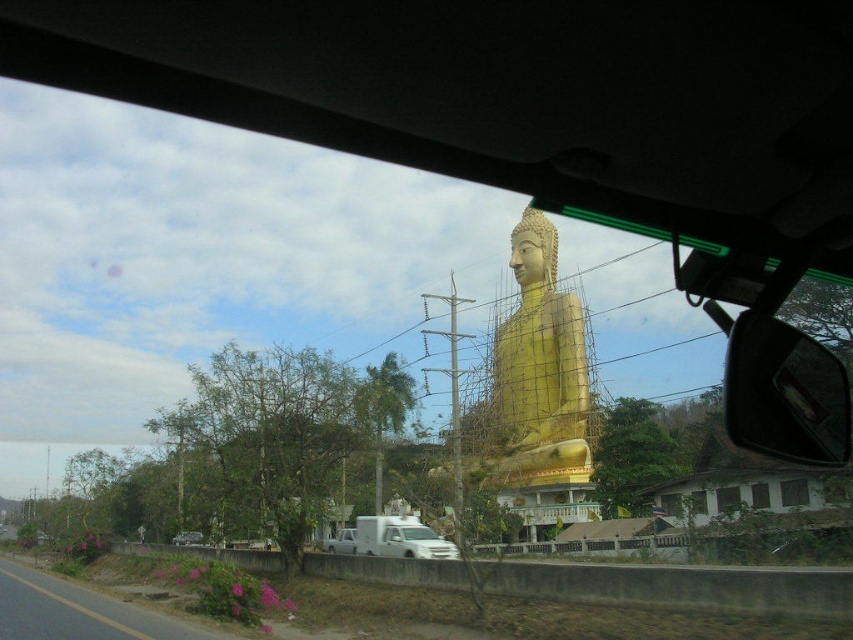
Does gold polished statue at center appear over metallic silver car at lower left?

Correct, gold polished statue at center is located above metallic silver car at lower left.

Locate an element on the screen. Image resolution: width=853 pixels, height=640 pixels. gold polished statue at center is located at coordinates (537, 372).

Is point (491, 388) positioned before point (173, 536)?

No, (491, 388) is further to viewer.

This screenshot has height=640, width=853. What are the coordinates of `gold polished statue at center` in the screenshot? It's located at (537, 372).

Does glossy plastic side mirror at right have a smaller size compared to metallic silver car at lower left?

Actually, glossy plastic side mirror at right might be larger than metallic silver car at lower left.

Which is above, glossy plastic side mirror at right or metallic silver car at lower left?

glossy plastic side mirror at right

At what (x,y) coordinates should I click in order to perform the action: click on glossy plastic side mirror at right. Please return your answer as a coordinate pair (x, y). The height and width of the screenshot is (640, 853). Looking at the image, I should click on (782, 392).

Does gold polished statue at center have a smaller size compared to white matte truck at center?

No.

Does gold polished statue at center lie in front of white matte truck at center?

Yes, gold polished statue at center is closer to the viewer.

This screenshot has height=640, width=853. What are the coordinates of `gold polished statue at center` in the screenshot? It's located at (537, 372).